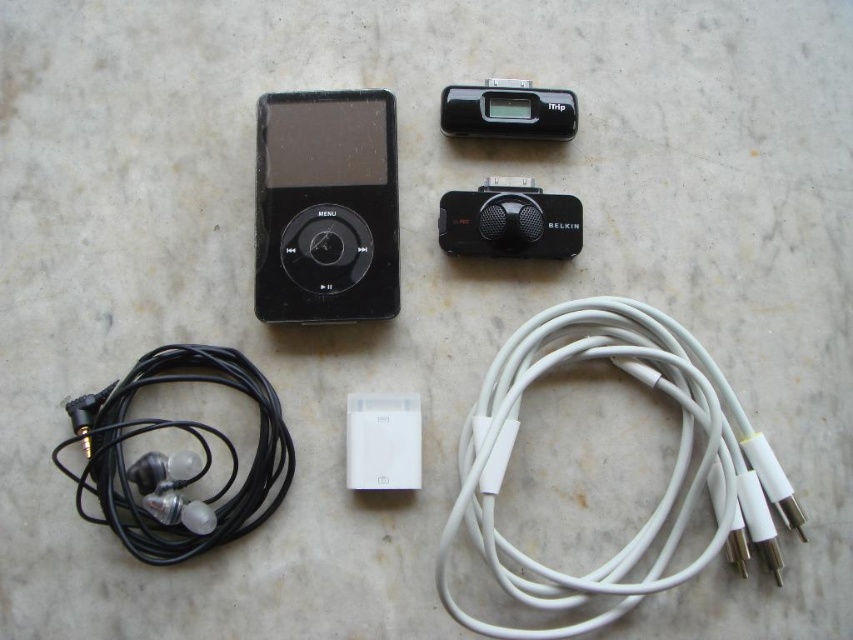
Question: Which of the following is the closest to the observer?

Choices:
 (A) white rubber cable at lower right
 (B) black plastic speaker at center

Answer: (A)

Question: Can you confirm if white rubber cable at lower right is positioned below black rubber earphones at lower left?

Choices:
 (A) no
 (B) yes

Answer: (B)

Question: Is black plastic speaker at center to the left of white plastic ipod at center from the viewer's perspective?

Choices:
 (A) yes
 (B) no

Answer: (B)

Question: Estimate the real-world distances between objects in this image. Which object is farther from the white plastic ipod at center?

Choices:
 (A) black plastic speaker at center
 (B) black matte/ipod at center
 (C) black plastic ipod at upper center
 (D) black rubber earphones at lower left

Answer: (C)

Question: Which point is closer to the camera?

Choices:
 (A) black plastic ipod at upper center
 (B) black matte/ipod at center

Answer: (B)

Question: Does black matte/ipod at center have a greater width compared to black plastic speaker at center?

Choices:
 (A) yes
 (B) no

Answer: (B)